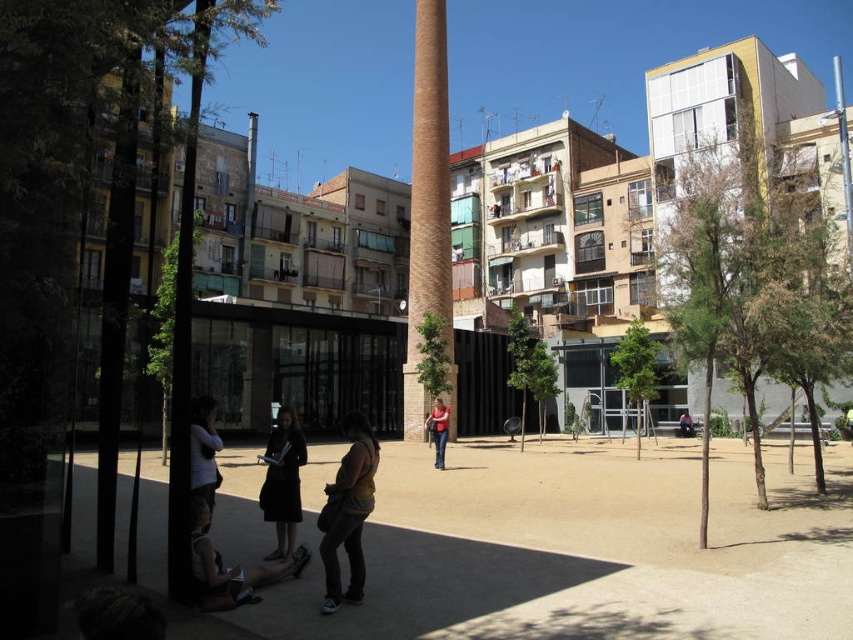
You are a fashion designer observing the urban plaza scene. You notice the dark brown leather jacket at center and the dark brown leather shoes at lower center. Which object has a smaller width when viewed from above?

The dark brown leather jacket at center is thinner than the dark brown leather shoes at lower center, so the jacket has a smaller width when viewed from above.

You are a fashion photographer who wants to capture both the dark brown leather jacket at center and the matte black dress at lower left in one frame. Based on their positions, which object is located to the right of the other?

The dark brown leather jacket at center is positioned on the right side of the matte black dress at lower left.